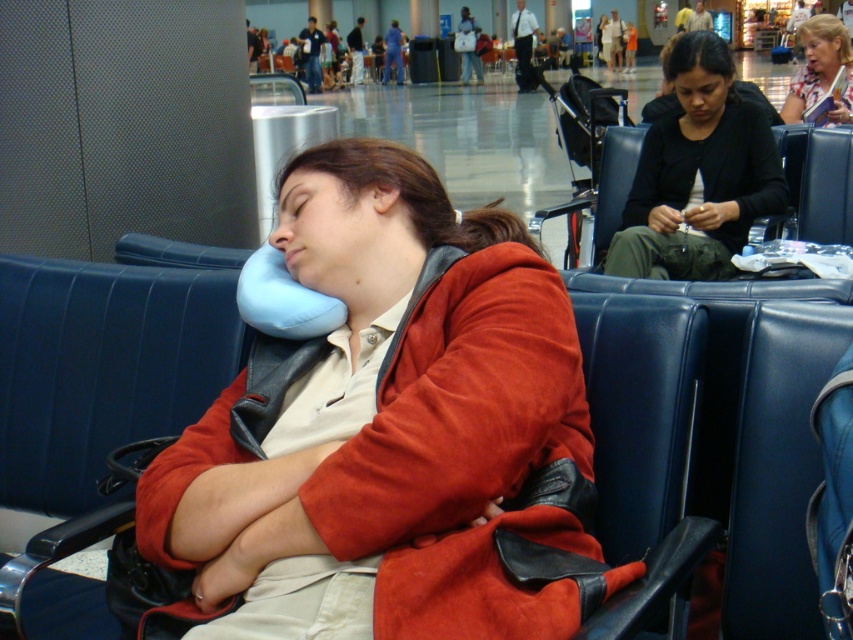
From the picture: Which is below, matte blue neck pillow at center or matte black jacket at center?

Positioned lower is matte blue neck pillow at center.

Is point (434, 474) closer to viewer compared to point (827, 65)?

Yes, it is.

Locate an element on the screen. matte blue neck pillow at center is located at coordinates (392, 432).

Who is positioned more to the left, matte blue neck pillow at center or black matte jacket at center?

Positioned to the left is matte blue neck pillow at center.

Identify the location of matte blue neck pillow at center. (392, 432).

Find the location of a particular element. Image resolution: width=853 pixels, height=640 pixels. matte blue neck pillow at center is located at coordinates (392, 432).

Does black matte jacket at center appear on the left side of matte black jacket at center?

Indeed, black matte jacket at center is positioned on the left side of matte black jacket at center.

Based on the photo, between black matte jacket at center and matte black jacket at center, which one appears on the left side from the viewer's perspective?

black matte jacket at center is more to the left.

Does point (701, 138) come behind point (840, 58)?

No, it is in front of (840, 58).

Identify the location of black matte jacket at center. The image size is (853, 640). (698, 173).